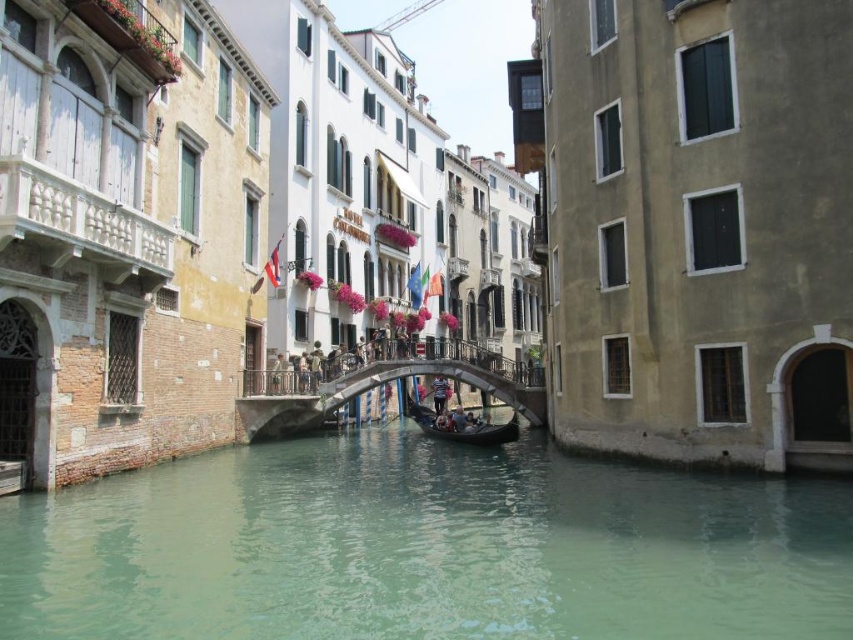
You are a tourist in Venice standing on the stone bridge at center. You want to take a photo of the green water at center. In which direction should you point your camera?

The green water at center is to the right of the stone bridge at center, so you should point your camera to the right to capture the green water at center.